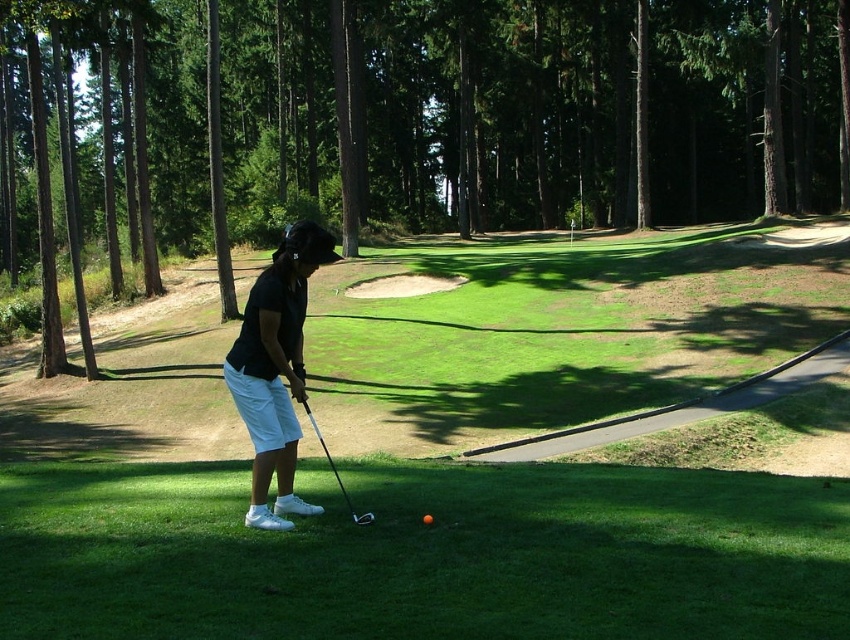
Is green grass at center in front of orange matte golf ball at center?

Yes.

Is green grass at center wider than orange matte golf ball at center?

Indeed, green grass at center has a greater width compared to orange matte golf ball at center.

Identify the location of green grass at center. The height and width of the screenshot is (640, 850). (437, 460).

Does white cotton shorts at center appear on the right side of orange matte golf ball at center?

In fact, white cotton shorts at center is to the left of orange matte golf ball at center.

Which is more to the right, white cotton shorts at center or orange matte golf ball at center?

orange matte golf ball at center

Is point (245, 426) farther from camera compared to point (425, 522)?

Yes.

Where is `white cotton shorts at center`? white cotton shorts at center is located at coordinates (275, 369).

Which is behind, point (817, 316) or point (290, 419)?

The point (817, 316) is behind.

Between green grass at center and white cotton shorts at center, which one is positioned lower?

green grass at center is below.

Locate an element on the screen. green grass at center is located at coordinates point(437,460).

In order to click on green grass at center in this screenshot , I will do `click(437, 460)`.